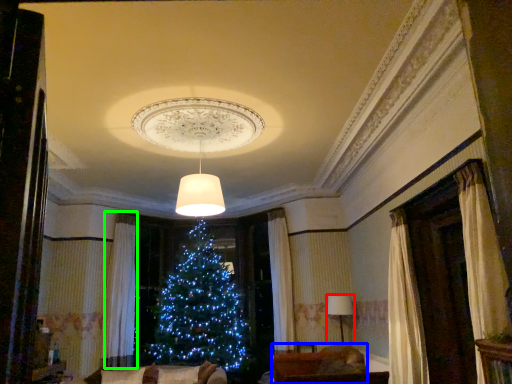
Question: Which is farther away from lamp (highlighted by a red box)? furniture (highlighted by a blue box) or curtain (highlighted by a green box)?

Choices:
 (A) furniture
 (B) curtain

Answer: (B)